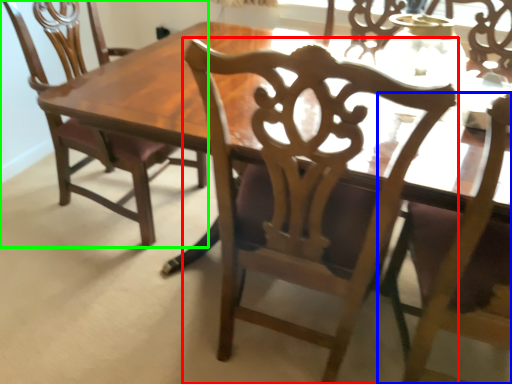
Question: Which is farther away from chair (highlighted by a red box)? chair (highlighted by a blue box) or chair (highlighted by a green box)?

Choices:
 (A) chair
 (B) chair

Answer: (B)